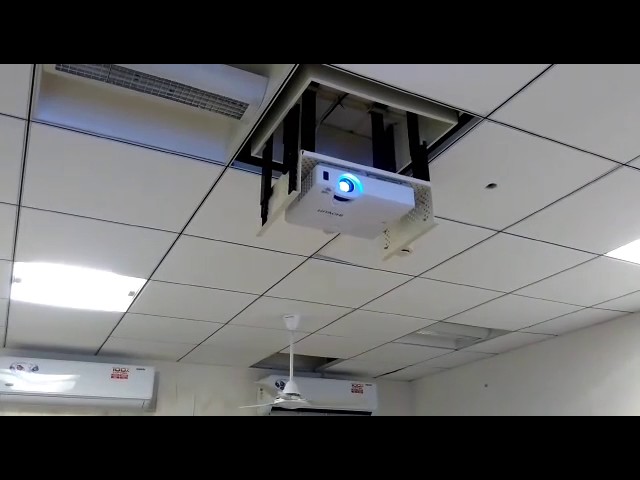
In order to click on ceiling fan in this screenshot , I will do `click(292, 386)`.